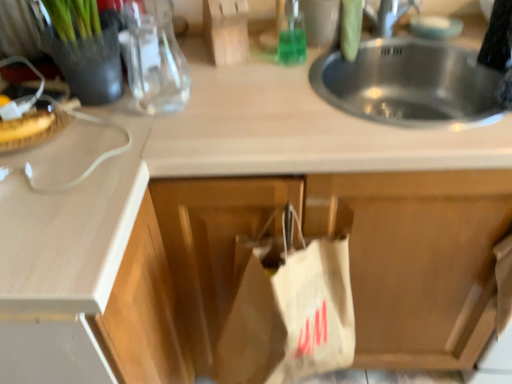
Question: Is breadtexturedat left surrounding green glass bottle at upper center, which appears as the 1th bottle when viewed from the back?

Choices:
 (A) no
 (B) yes

Answer: (A)

Question: Is breadtexturedat left outside of green glass bottle at upper center, which appears as the 1th bottle when viewed from the back?

Choices:
 (A) no
 (B) yes

Answer: (B)

Question: Considering the relative sizes of breadtexturedat left and green glass bottle at upper center, which appears as the 2th bottle when viewed from the left, in the image provided, is breadtexturedat left smaller than green glass bottle at upper center, which appears as the 2th bottle when viewed from the left,?

Choices:
 (A) no
 (B) yes

Answer: (A)

Question: Considering the relative sizes of breadtexturedat left and green glass bottle at upper center, which appears as the 1th bottle when viewed from the back, in the image provided, is breadtexturedat left taller than green glass bottle at upper center, which appears as the 1th bottle when viewed from the back,?

Choices:
 (A) yes
 (B) no

Answer: (B)

Question: Could you tell me if breadtexturedat left is turned towards green glass bottle at upper center, which appears as the 2th bottle when viewed from the left?

Choices:
 (A) no
 (B) yes

Answer: (A)

Question: Considering their positions, is white paper bag at center located in front of or behind transparent glass bottle at upper left, the 1th bottle positioned from the left?

Choices:
 (A) behind
 (B) front

Answer: (B)

Question: Considering the positions of point (293, 246) and point (163, 99), is point (293, 246) closer or farther from the camera than point (163, 99)?

Choices:
 (A) farther
 (B) closer

Answer: (B)

Question: Is white paper bag at center inside or outside of transparent glass bottle at upper left, the 1th bottle positioned from the left?

Choices:
 (A) outside
 (B) inside

Answer: (A)

Question: From the image's perspective, relative to transparent glass bottle at upper left, which is the second bottle from back to front, is white paper bag at center above or below?

Choices:
 (A) above
 (B) below

Answer: (B)

Question: Based on their positions, is white matte cabinet at center located to the left or right of green glass bottle at upper center, which appears as the 1th bottle when viewed from the back?

Choices:
 (A) left
 (B) right

Answer: (B)

Question: In terms of height, does white matte cabinet at center look taller or shorter compared to green glass bottle at upper center, which appears as the 2th bottle when viewed from the left?

Choices:
 (A) short
 (B) tall

Answer: (B)

Question: Considering the positions of white matte cabinet at center and green glass bottle at upper center, the 1th bottle viewed from the right, in the image, is white matte cabinet at center wider or thinner than green glass bottle at upper center, the 1th bottle viewed from the right,?

Choices:
 (A) wide
 (B) thin

Answer: (A)

Question: In the image, is white matte cabinet at center positioned in front of or behind green glass bottle at upper center, which appears as the 1th bottle when viewed from the back?

Choices:
 (A) behind
 (B) front

Answer: (B)

Question: In terms of height, does white paper bag at center look taller or shorter compared to white matte cabinet at center?

Choices:
 (A) tall
 (B) short

Answer: (B)

Question: Relative to white matte cabinet at center, is white paper bag at center in front or behind?

Choices:
 (A) front
 (B) behind

Answer: (A)